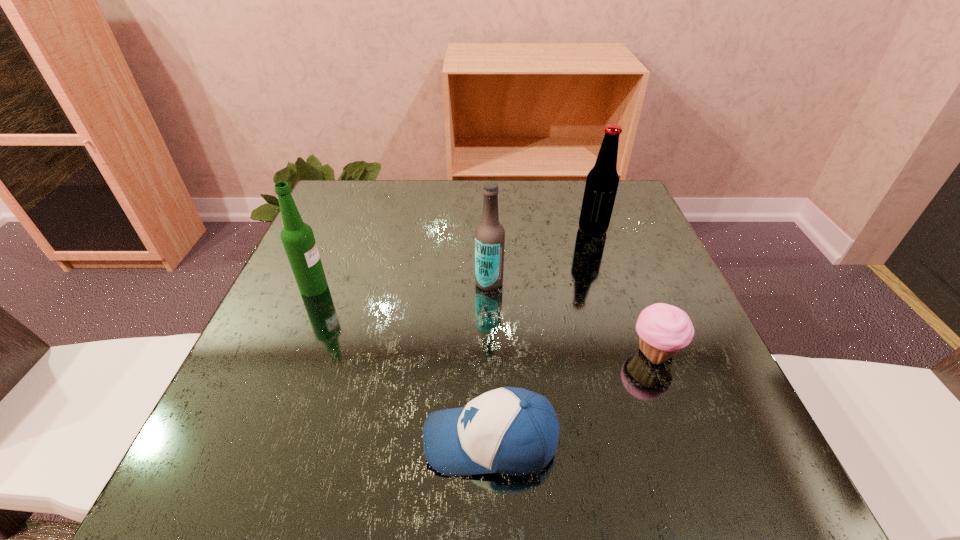
Where is `free spot between the nearest object and the leftmost object`? free spot between the nearest object and the leftmost object is located at coordinates (402, 364).

At what (x,y) coordinates should I click in order to perform the action: click on empty space that is in between the nearest object and the leftmost object. Please return your answer as a coordinate pair (x, y). The image size is (960, 540). Looking at the image, I should click on (402, 364).

The width and height of the screenshot is (960, 540). I want to click on blank region between the farthest beer bottle and the second beer bottle from left to right, so click(541, 256).

I want to click on vacant space that's between the rightmost beer bottle and the second beer bottle from left to right, so click(541, 256).

I want to click on free spot between the second beer bottle from right to left and the cupcake, so click(x=572, y=318).

I want to click on vacant space that is in between the cupcake and the nearest object, so click(573, 397).

Locate an element on the screen. vacant space in between the second beer bottle from left to right and the nearest object is located at coordinates (490, 362).

Find the location of a particular element. the third closest object to the rightmost beer bottle is located at coordinates (509, 430).

Locate an element on the screen. This screenshot has width=960, height=540. object that is the closest to the nearest object is located at coordinates (663, 329).

Locate which beer bottle is the third closest to the baseball cap. Please provide its 2D coordinates. Your answer should be formatted as a tuple, i.e. [(x, y)], where the tuple contains the x and y coordinates of a point satisfying the conditions above.

[(602, 181)]